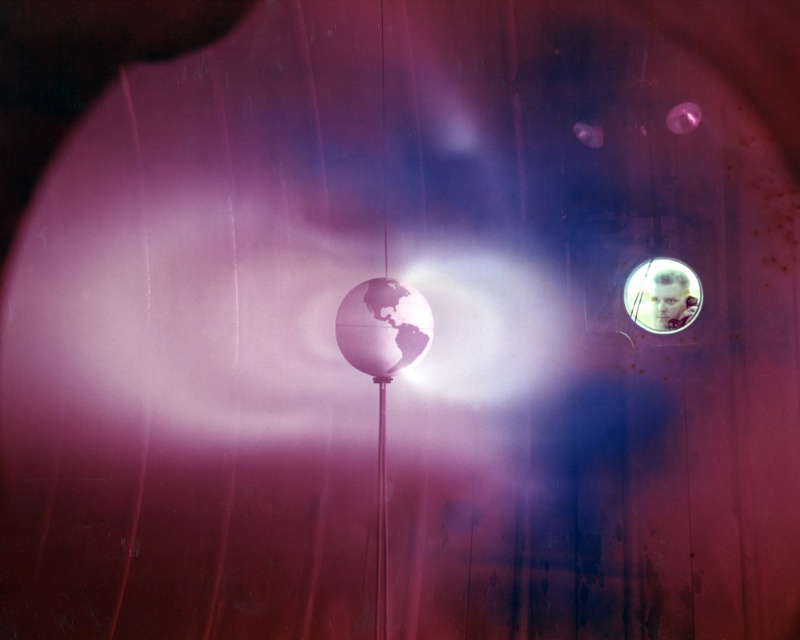
Question: Which is nearer to the translucent plastic bubble at upper right?

Choices:
 (A) matte metallic globe at center
 (B) metallic pole at center

Answer: (A)

Question: Can you confirm if matte metallic globe at center is bigger than translucent plastic bubble at upper right?

Choices:
 (A) yes
 (B) no

Answer: (A)

Question: Does matte metallic globe at center have a larger size compared to translucent plastic bubble at upper right?

Choices:
 (A) no
 (B) yes

Answer: (B)

Question: Can you confirm if matte metallic globe at center is thinner than translucent plastic bubble at upper right?

Choices:
 (A) yes
 (B) no

Answer: (B)

Question: Which of the following is the farthest from the observer?

Choices:
 (A) (385, 580)
 (B) (668, 269)
 (C) (397, 317)

Answer: (B)

Question: Among these points, which one is nearest to the camera?

Choices:
 (A) (696, 292)
 (B) (400, 358)
 (C) (380, 376)

Answer: (B)